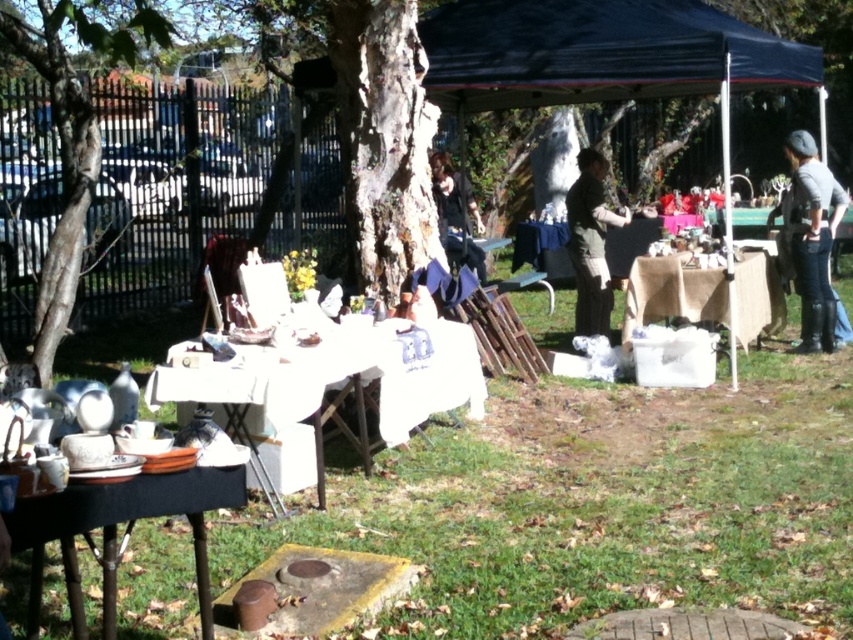
Looking at this image, you are a customer at the flea market looking for a tent to buy. The blue fabric tent at upper center is located at point (608, 65). Can you describe where the blue fabric tent at upper center is in relation to the other items displayed on the tables?

The blue fabric tent at upper center is located at point (608, 65), which is above the tables displaying kitchenware and near the center of the image.

You are standing at the flea market and want to pick up an item. You see two points marked in the scene. Which point is closer to you, point [730,40] or point [61,316]?

Point [61,316] is closer to you because it is less further to the camera than point [730,40].